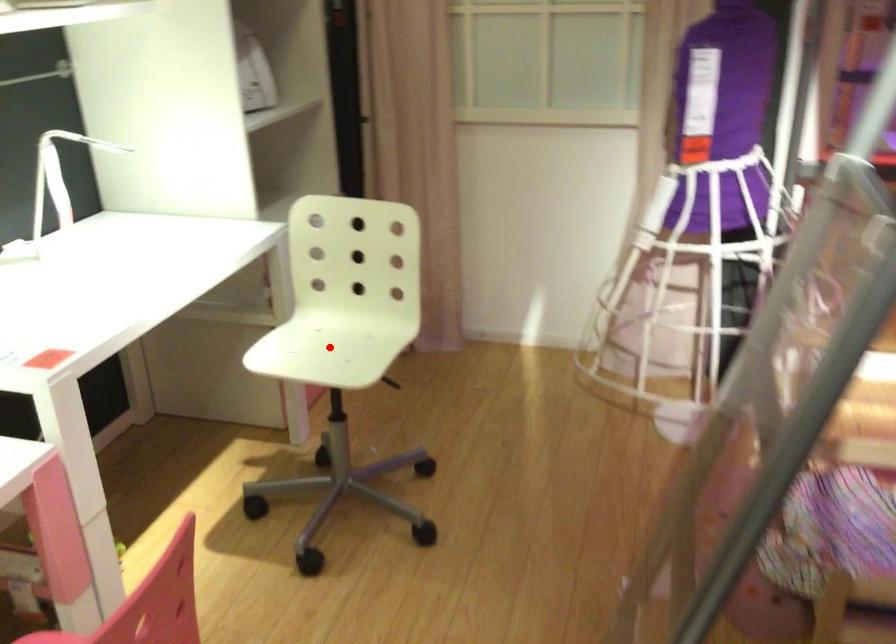
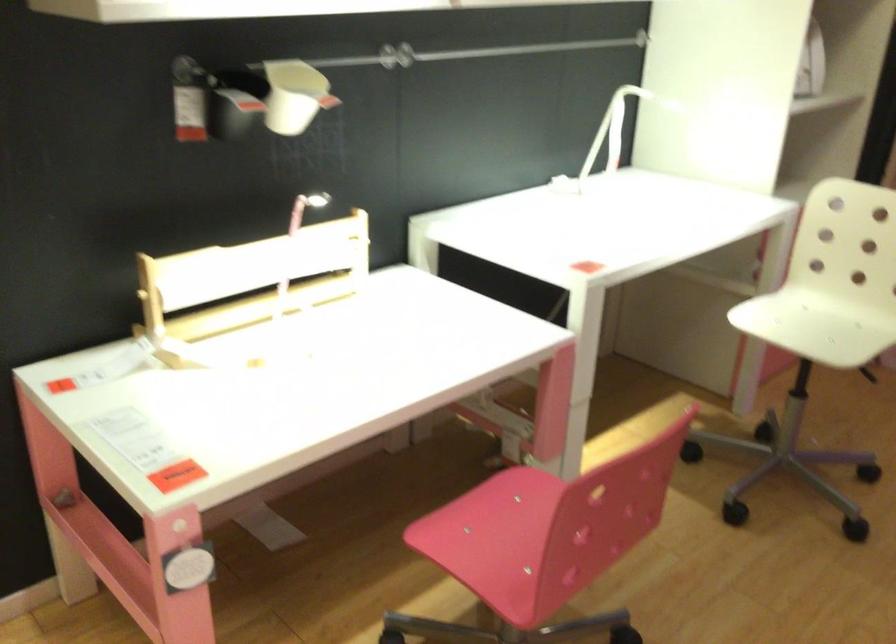
Locate, in the second image, the point that corresponds to the highlighted location in the first image.

(812, 327)